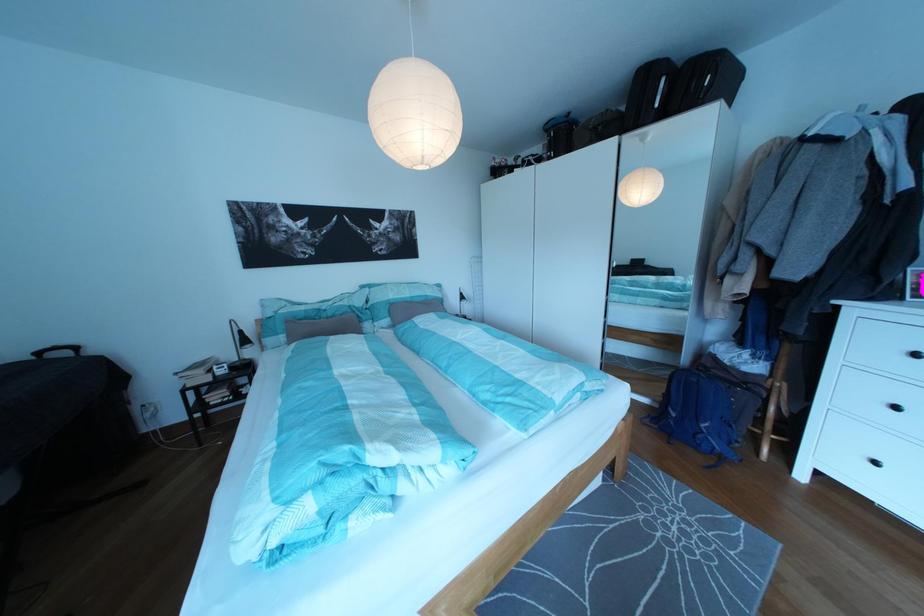
Where would you lift the black suitcase handle? Please return your answer as a coordinate pair (x, y).

(704, 81)